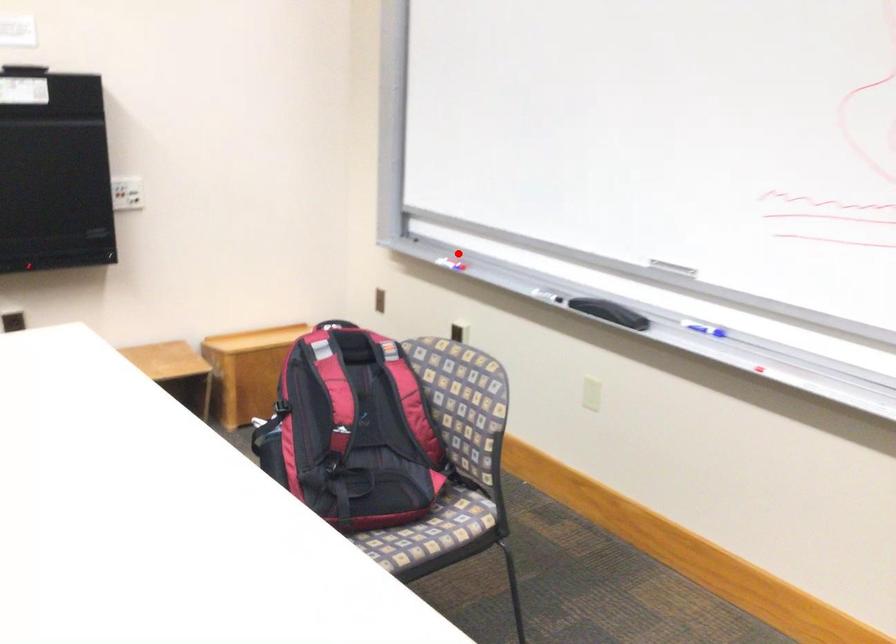
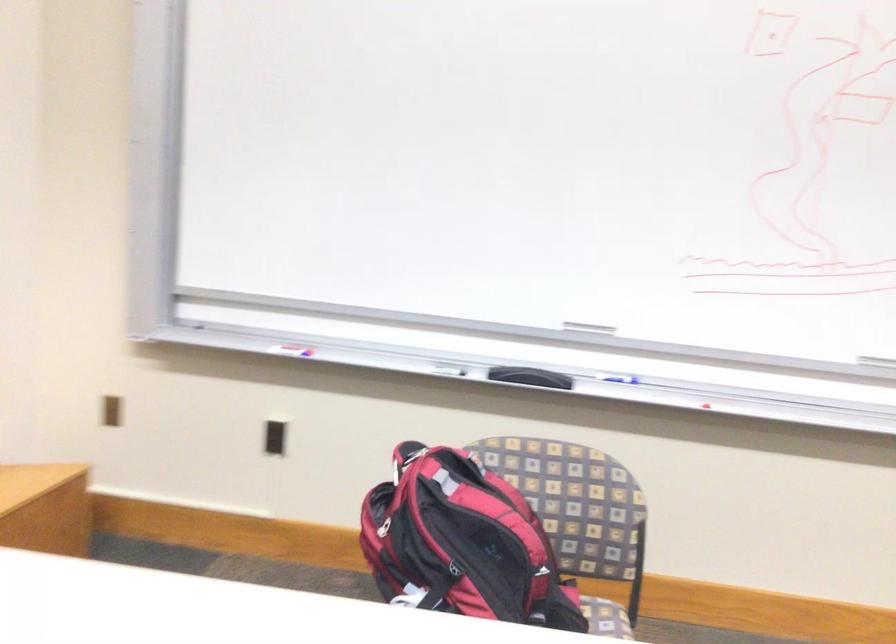
Question: I am providing you with two images of the same scene from different viewpoints. In image1, a red point is highlighted. Considering the same 3D point in image2, which of the following is correct?

Choices:
 (A) It is closer
 (B) It is farther

Answer: (A)